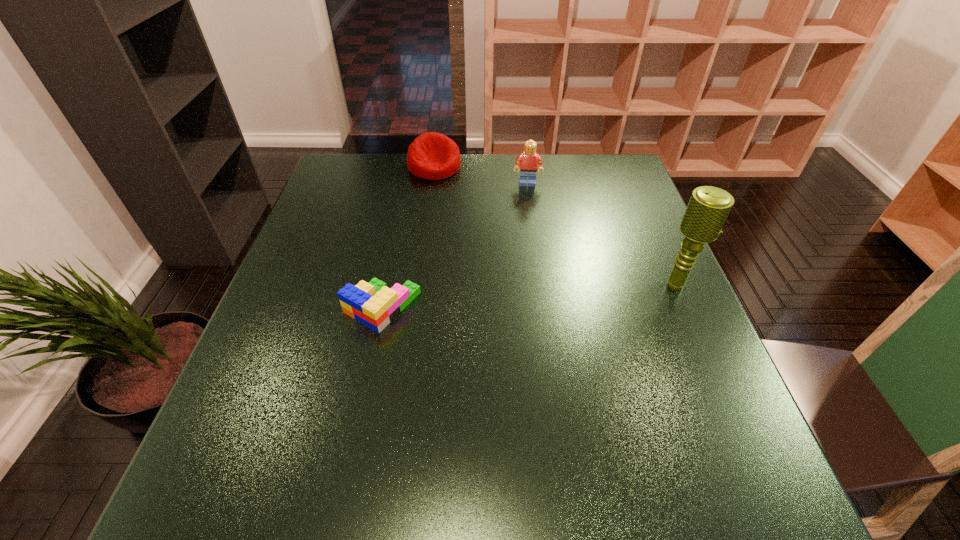
At what (x,y) coordinates should I click in order to perform the action: click on free region that satisfies the following two spatial constraints: 1. on the back side of the farther Lego; 2. on the left side of the shorter Lego. Please return your answer as a coordinate pair (x, y). Looking at the image, I should click on (408, 184).

In order to click on free spot that satisfies the following two spatial constraints: 1. on the front side of the second shortest object; 2. on the left side of the taller Lego in this screenshot , I will do `click(432, 184)`.

Locate an element on the screen. Image resolution: width=960 pixels, height=540 pixels. vacant point that satisfies the following two spatial constraints: 1. on the back side of the left Lego; 2. on the left side of the beanbag is located at coordinates (411, 167).